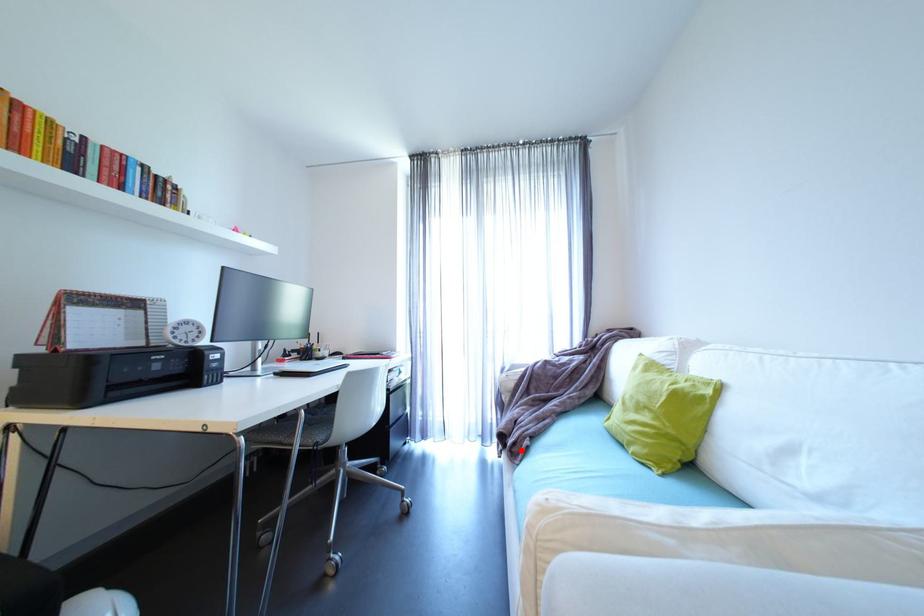
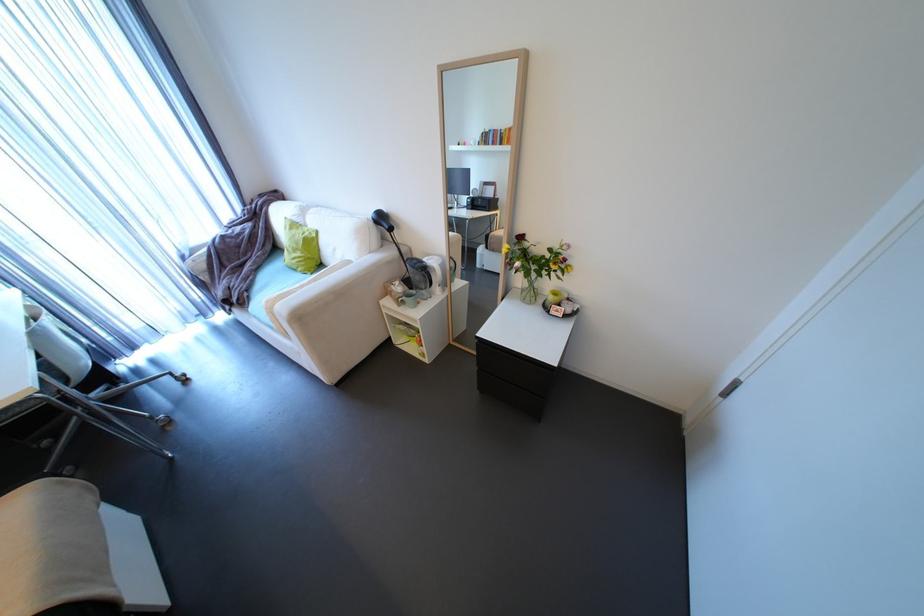
Find the pixel in the second image that matches the highlighted location in the first image.

(248, 302)